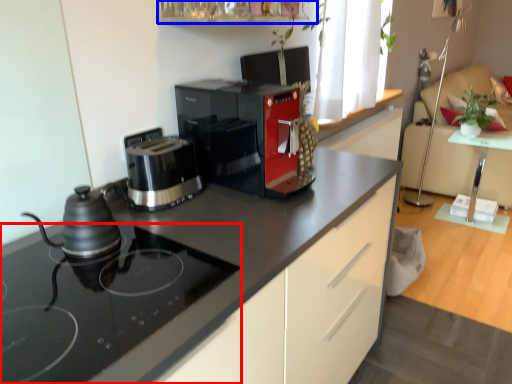
Question: Which object is further to the camera taking this photo, home appliance (highlighted by a red box) or shelf (highlighted by a blue box)?

Choices:
 (A) home appliance
 (B) shelf

Answer: (B)